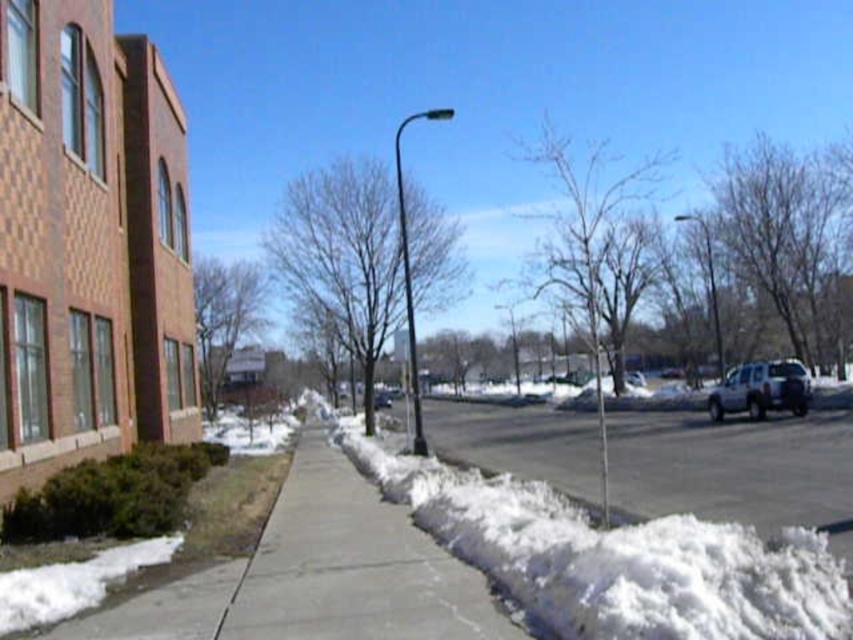
Between point (381, 468) and point (728, 404), which one is positioned behind?

Point (728, 404)

Which of these two, white fluffy snow at lower right or white matte truck at right, stands shorter?

Standing shorter between the two is white fluffy snow at lower right.

Which is in front, point (554, 492) or point (746, 376)?

Point (554, 492) is more forward.

Image resolution: width=853 pixels, height=640 pixels. I want to click on white fluffy snow at lower right, so click(616, 557).